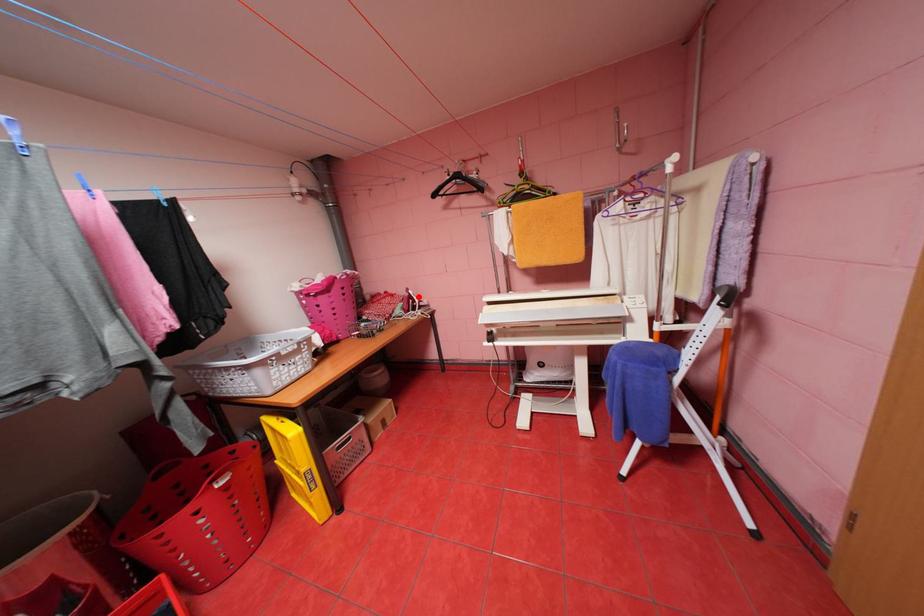
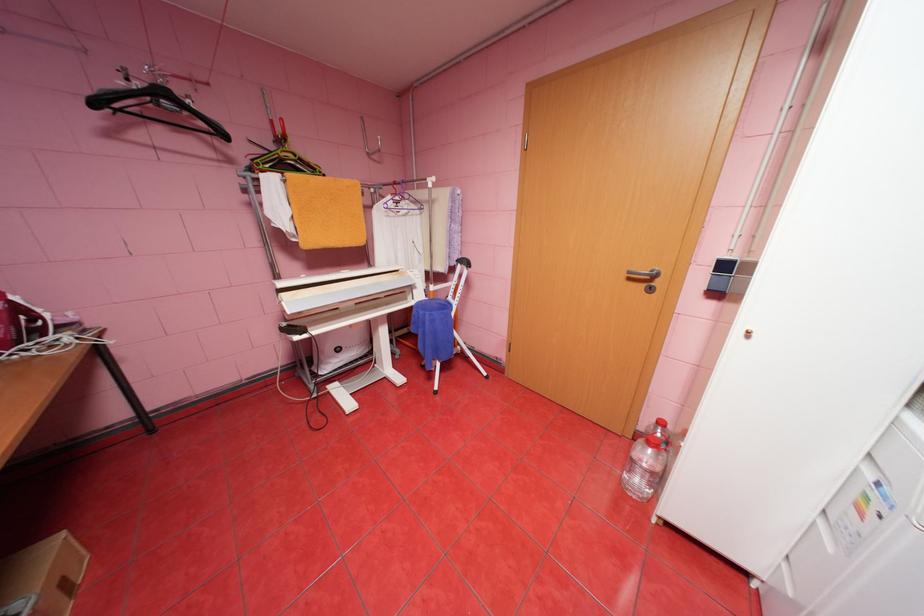
In the second image, find the point that corresponds to the highlighted location in the first image.

(26, 309)